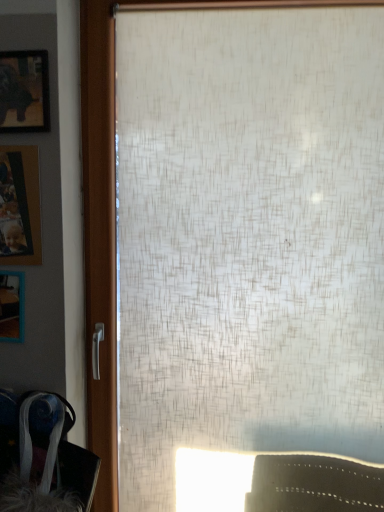
Question: Is velvet-like fabric swivel chair at lower left turned away from wooden photo frame at left, placed as the 2th picture frame when sorted from top to bottom?

Choices:
 (A) yes
 (B) no

Answer: (B)

Question: Does velvet-like fabric swivel chair at lower left appear on the left side of wooden photo frame at left, which is the second picture frame in bottom-to-top order?

Choices:
 (A) yes
 (B) no

Answer: (B)

Question: From the image's perspective, is velvet-like fabric swivel chair at lower left on top of wooden photo frame at left, placed as the 2th picture frame when sorted from top to bottom?

Choices:
 (A) no
 (B) yes

Answer: (A)

Question: From a real-world perspective, does velvet-like fabric swivel chair at lower left stand above wooden photo frame at left, placed as the 2th picture frame when sorted from top to bottom?

Choices:
 (A) yes
 (B) no

Answer: (B)

Question: Does velvet-like fabric swivel chair at lower left lie behind wooden photo frame at left, which is the second picture frame in bottom-to-top order?

Choices:
 (A) no
 (B) yes

Answer: (A)

Question: Based on their positions, is wooden photo frame at left, which is the second picture frame in bottom-to-top order, located to the left or right of wooden frame at left, positioned as the third picture frame in top-to-bottom order?

Choices:
 (A) right
 (B) left

Answer: (A)

Question: Is point (19, 202) closer or farther from the camera than point (0, 311)?

Choices:
 (A) closer
 (B) farther

Answer: (A)

Question: Is wooden photo frame at left, which is the second picture frame in bottom-to-top order, taller or shorter than wooden frame at left, positioned as the third picture frame in top-to-bottom order?

Choices:
 (A) short
 (B) tall

Answer: (B)

Question: In terms of size, does wooden photo frame at left, which is the second picture frame in bottom-to-top order, appear bigger or smaller than wooden frame at left, positioned as the third picture frame in top-to-bottom order?

Choices:
 (A) big
 (B) small

Answer: (A)

Question: Would you say matte black picture frame at upper left, which ranks as the 1th picture frame in top-to-bottom order, is inside or outside wooden frame at left, positioned as the third picture frame in top-to-bottom order?

Choices:
 (A) inside
 (B) outside

Answer: (B)

Question: Would you say matte black picture frame at upper left, positioned as the third picture frame in bottom-to-top order, is to the left or to the right of wooden frame at left, positioned as the third picture frame in top-to-bottom order, in the picture?

Choices:
 (A) right
 (B) left

Answer: (A)

Question: Considering the positions of matte black picture frame at upper left, positioned as the third picture frame in bottom-to-top order, and wooden frame at left, positioned as the third picture frame in top-to-bottom order, in the image, is matte black picture frame at upper left, positioned as the third picture frame in bottom-to-top order, bigger or smaller than wooden frame at left, positioned as the third picture frame in top-to-bottom order,?

Choices:
 (A) small
 (B) big

Answer: (A)

Question: In the image, is matte black picture frame at upper left, which ranks as the 1th picture frame in top-to-bottom order, positioned in front of or behind wooden frame at left, positioned as the third picture frame in top-to-bottom order?

Choices:
 (A) behind
 (B) front

Answer: (B)

Question: Based on their sizes in the image, would you say velvet-like fabric swivel chair at lower left is bigger or smaller than wooden photo frame at left, placed as the 2th picture frame when sorted from top to bottom?

Choices:
 (A) small
 (B) big

Answer: (B)

Question: Considering the positions of velvet-like fabric swivel chair at lower left and wooden photo frame at left, which is the second picture frame in bottom-to-top order, in the image, is velvet-like fabric swivel chair at lower left taller or shorter than wooden photo frame at left, which is the second picture frame in bottom-to-top order,?

Choices:
 (A) tall
 (B) short

Answer: (A)